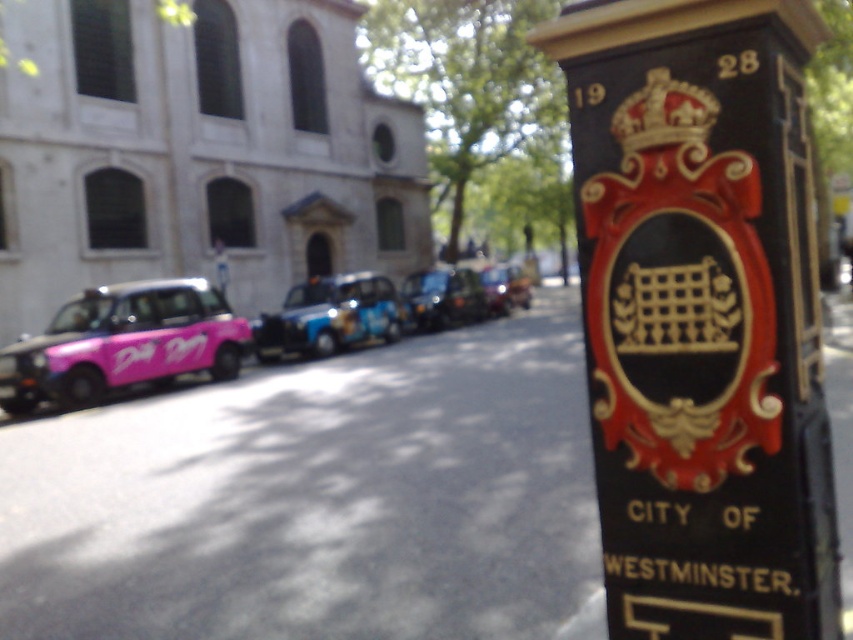
Question: Can you confirm if pink matte taxi at left is wider than metallic blue taxi at center?

Choices:
 (A) yes
 (B) no

Answer: (B)

Question: Which object is the closest to the metallic blue taxi at center?

Choices:
 (A) blue metallic taxi at center
 (B) pink matte taxi at left

Answer: (A)

Question: Is pink matte taxi at left above metallic blue taxi at center?

Choices:
 (A) yes
 (B) no

Answer: (B)

Question: Among these objects, which one is nearest to the camera?

Choices:
 (A) blue metallic taxi at center
 (B) metallic blue taxi at center

Answer: (A)

Question: Is blue metallic taxi at center below metallic blue taxi at center?

Choices:
 (A) no
 (B) yes

Answer: (B)

Question: Which of the following is the closest to the observer?

Choices:
 (A) (347, 292)
 (B) (225, 376)

Answer: (B)